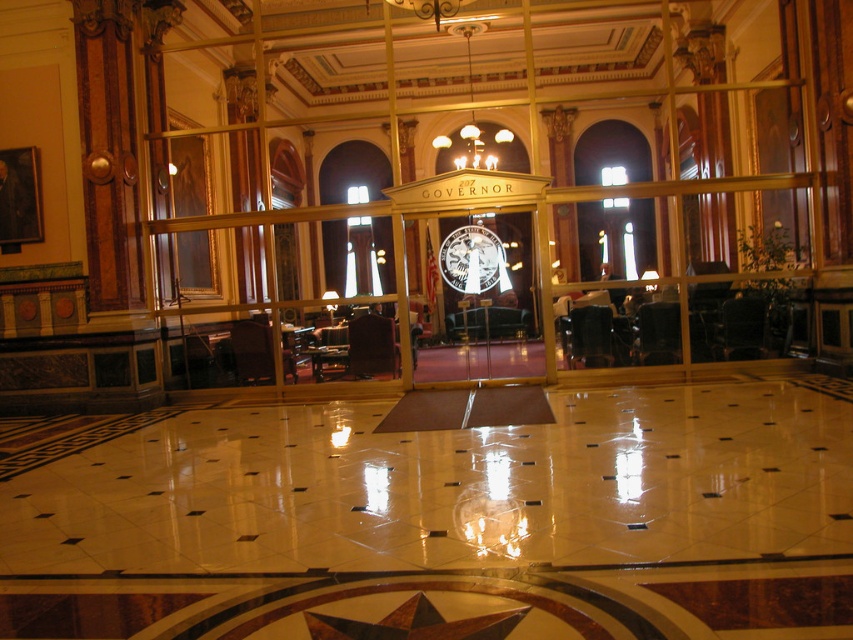
Which is above, wooden star at center or metallic silver clock at center?

Positioned higher is metallic silver clock at center.

Does wooden star at center have a greater height compared to metallic silver clock at center?

No.

Describe the element at coordinates (415, 624) in the screenshot. I see `wooden star at center` at that location.

Locate an element on the screen. wooden star at center is located at coordinates pyautogui.click(x=415, y=624).

Does wooden star at center appear on the left side of gold metallic chandelier at upper center?

Indeed, wooden star at center is positioned on the left side of gold metallic chandelier at upper center.

Who is more distant from viewer, [440,628] or [502,129]?

The point [502,129] is more distant.

Image resolution: width=853 pixels, height=640 pixels. I want to click on wooden star at center, so click(415, 624).

Can you confirm if metallic silver clock at center is positioned above gold metallic chandelier at upper center?

No, metallic silver clock at center is not above gold metallic chandelier at upper center.

Does metallic silver clock at center appear on the left side of gold metallic chandelier at upper center?

Yes, metallic silver clock at center is to the left of gold metallic chandelier at upper center.

Is point (454, 266) positioned behind point (509, 132)?

No, (454, 266) is in front of (509, 132).

Identify the location of metallic silver clock at center. (473, 260).